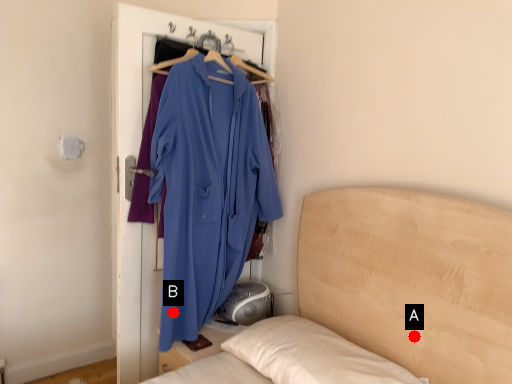
Question: Two points are circled on the image, labeled by A and B beside each circle. Which point is farther from the camera taking this photo?

Choices:
 (A) A is further
 (B) B is further

Answer: (B)